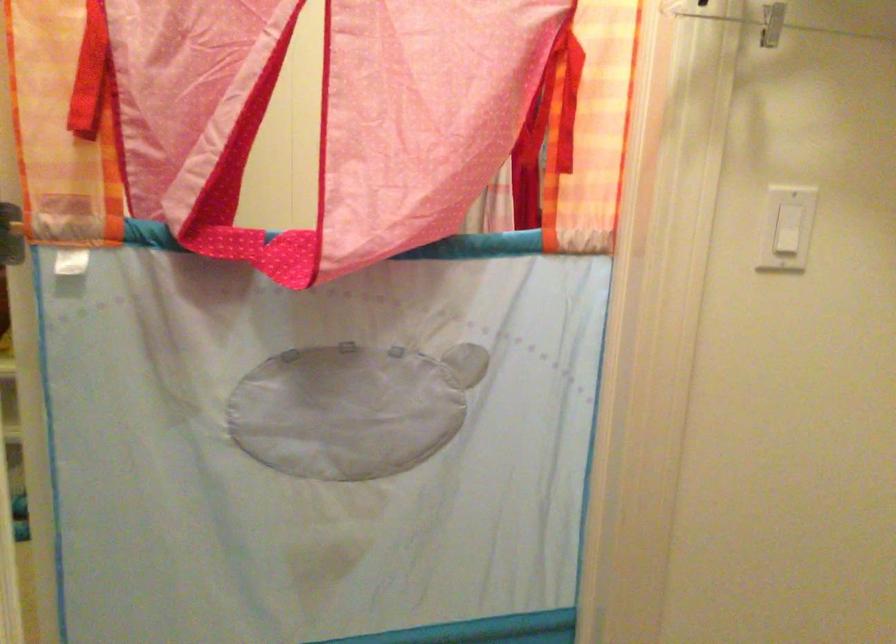
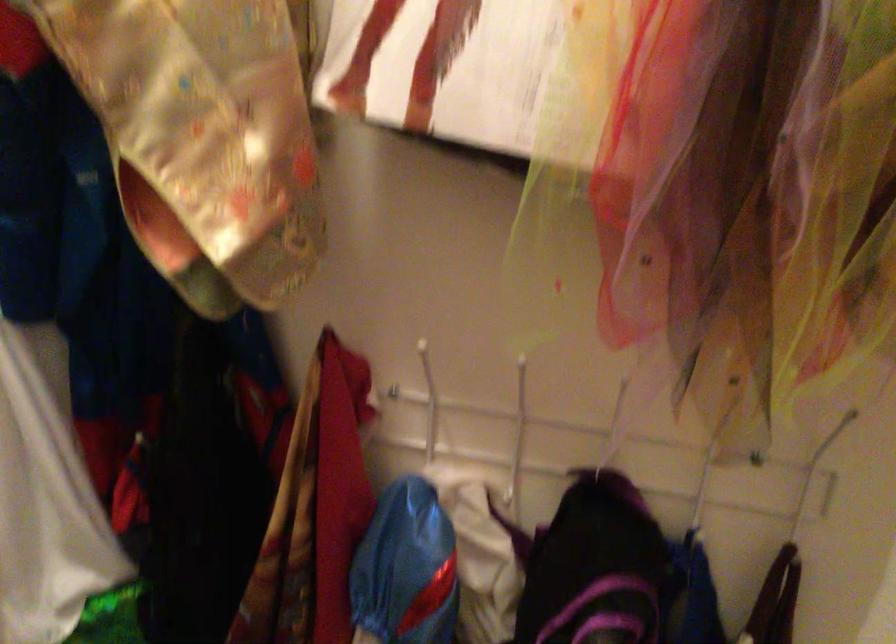
First-person continuous shooting, in which direction is the camera rotating?

The camera's rotation is toward left-down.